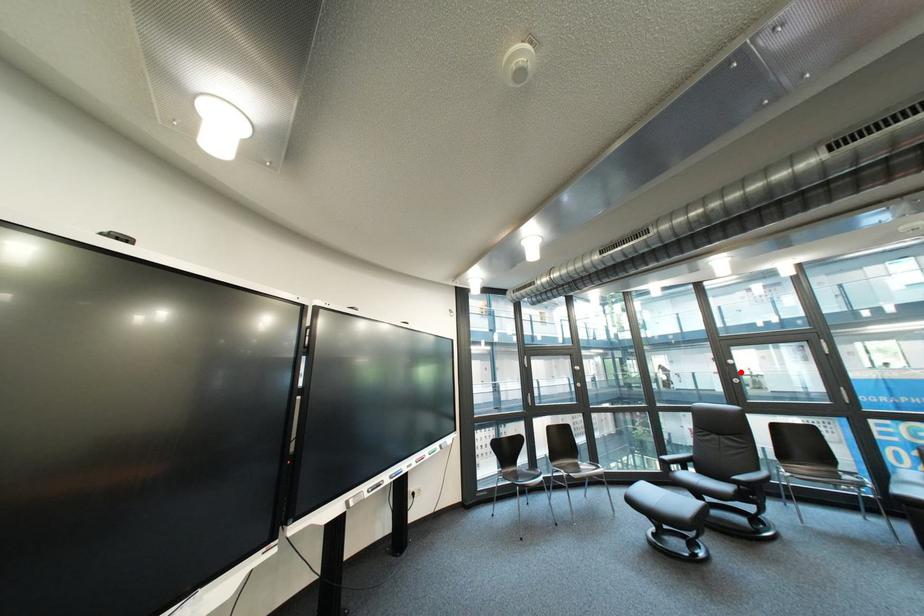
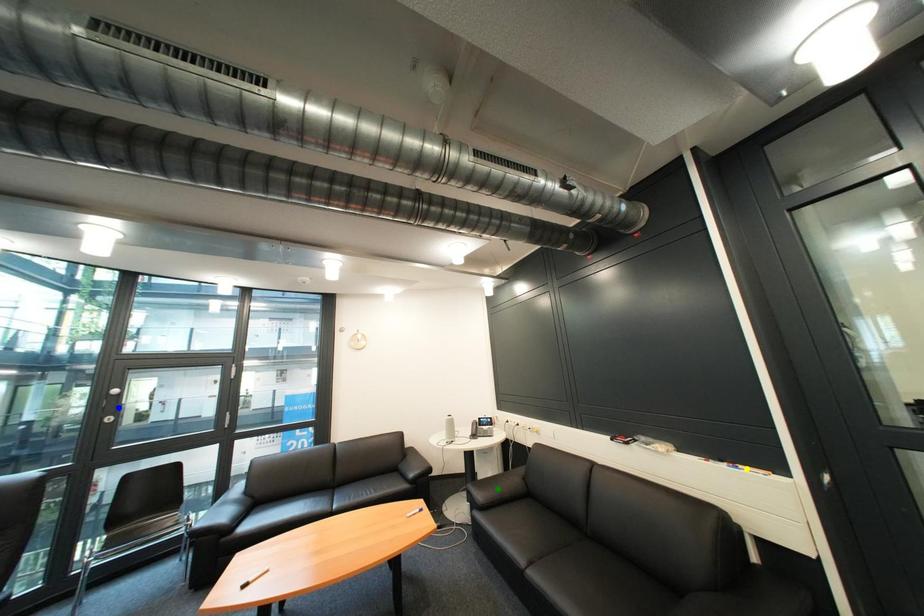
Question: I am providing you with two images of the same scene from different viewpoints. A red point is marked on the first image. You are given multiple points on the second image. Which spot in image 2 lines up with the point in image 1?

Choices:
 (A) yellow point
 (B) green point
 (C) blue point

Answer: (C)